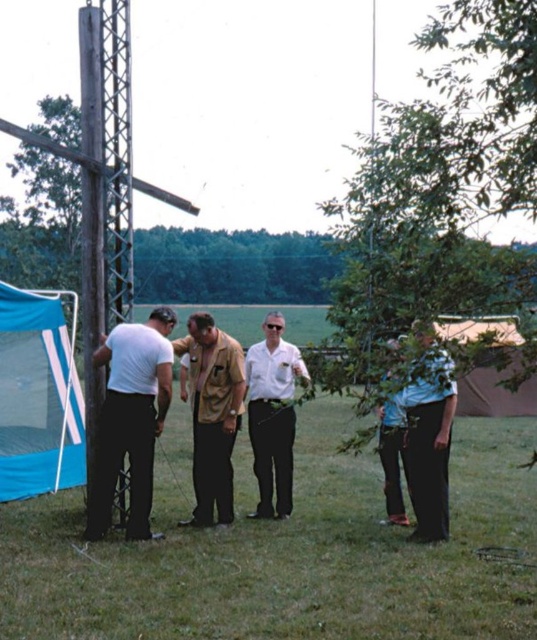
Question: Among these points, which one is nearest to the camera?

Choices:
 (A) (264, 506)
 (B) (55, 486)
 (C) (105, 276)
 (D) (223, 404)

Answer: (C)

Question: Can you confirm if brown wooden pole at left is positioned to the left of white matte shirt at left?

Choices:
 (A) no
 (B) yes

Answer: (B)

Question: Is blue fabric tent at lower left closer to camera compared to white glossy shirt at center?

Choices:
 (A) yes
 (B) no

Answer: (B)

Question: Among these points, which one is farthest from the camera?

Choices:
 (A) (113, 380)
 (B) (52, 588)

Answer: (A)

Question: Considering the real-world distances, which object is closest to the white matte shirt at left?

Choices:
 (A) white glossy shirt at center
 (B) blue cotton shirt at right

Answer: (A)

Question: Can you confirm if blue fabric tent at lower left is positioned below white glossy shirt at center?

Choices:
 (A) yes
 (B) no

Answer: (B)